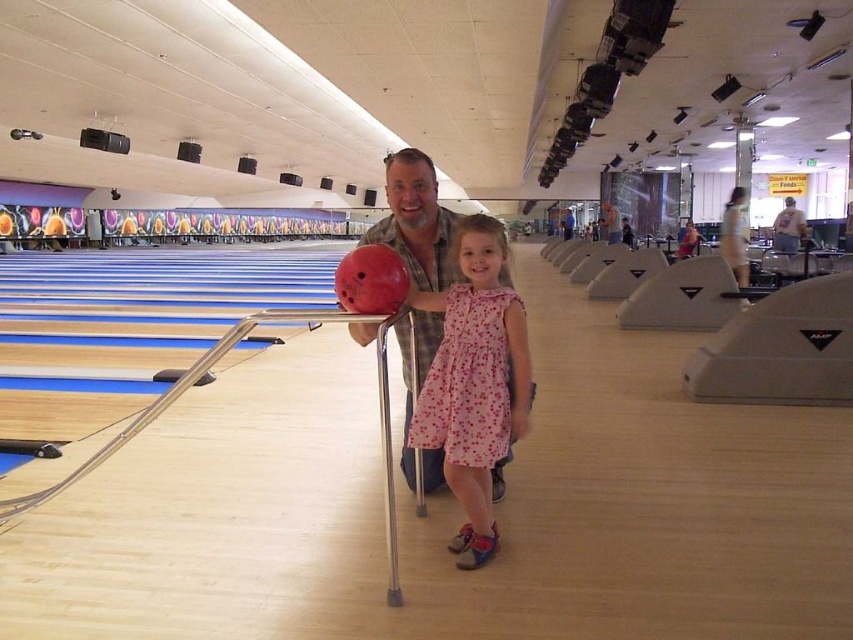
You are a photographer trying to capture the pink floral dress at center and the matte black bowling ball at center in a single shot. Based on their sizes, which object should you focus on first to ensure both are in frame?

The pink floral dress at center has a lesser width compared to the matte black bowling ball at center, so you should focus on the matte black bowling ball at center first to accommodate its larger size within the frame.

You are standing at the center of the bowling alley and see two points marked in the scene. Which point, point (511,330) or point (454,259), is closer to you?

Point (511,330) is closer to the viewer than point (454,259).

You are standing at the entrance of the bowling alley and want to locate two specific points in the image. The first point is at coordinates point (x=488, y=220) and the second is at point (x=611, y=204). Which of these two points is nearer to your current position?

Point (x=488, y=220) is closer to the camera than point (x=611, y=204), so the first point is nearer to your current position.